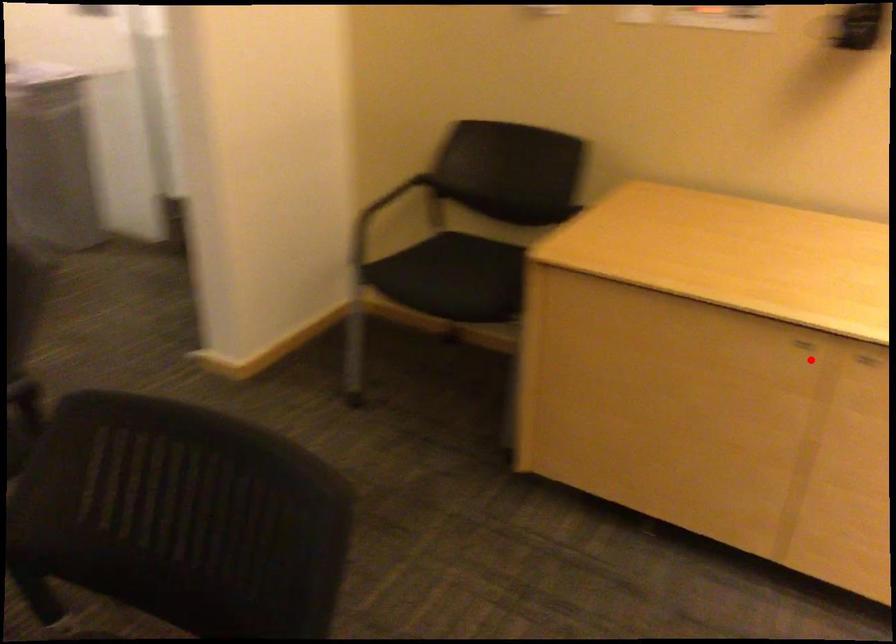
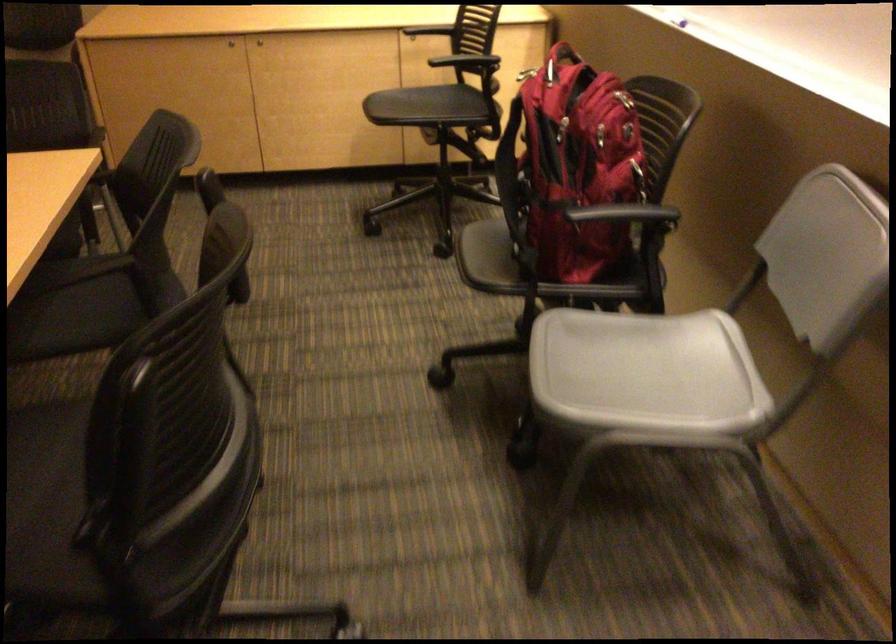
In the second image, find the point that corresponds to the highlighted location in the first image.

(230, 44)